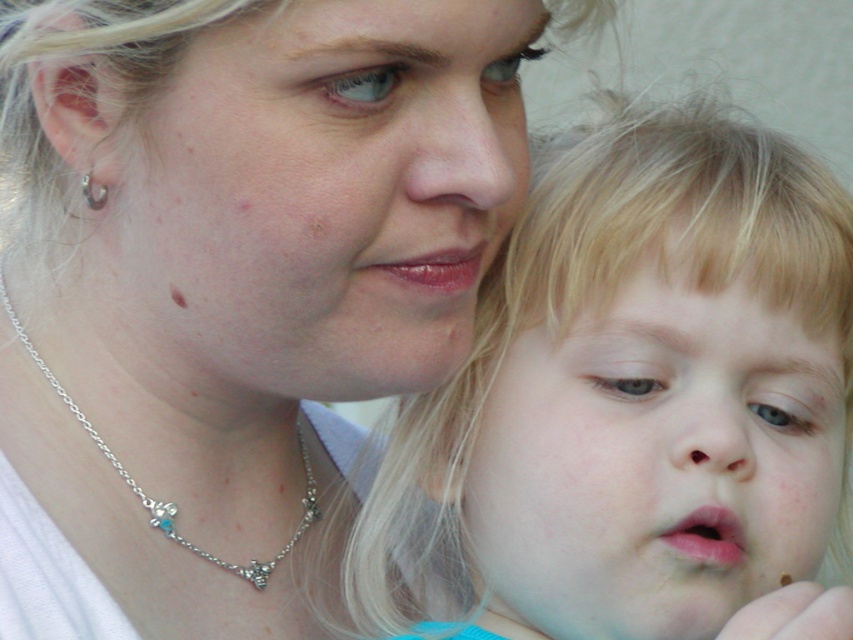
You are a photographer who wants to ensure the matte silver necklace at center and the smooth blonde hair at center are both visible in the final portrait. Based on their positions, which object is closer to the top of the frame?

The matte silver necklace at center is above the smooth blonde hair at center, so it is closer to the top of the frame.